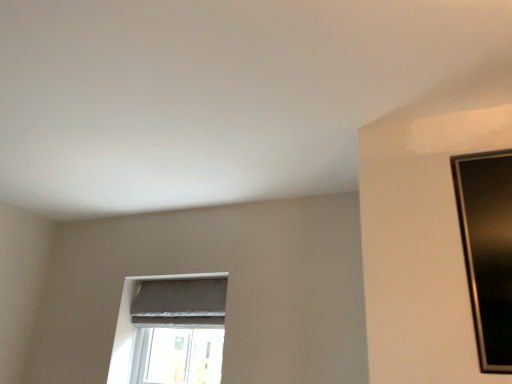
The image size is (512, 384). I want to click on gray fabric window at center, so click(x=170, y=330).

The width and height of the screenshot is (512, 384). Describe the element at coordinates (170, 330) in the screenshot. I see `gray fabric window at center` at that location.

Identify the location of gray fabric window at center. The width and height of the screenshot is (512, 384). (170, 330).